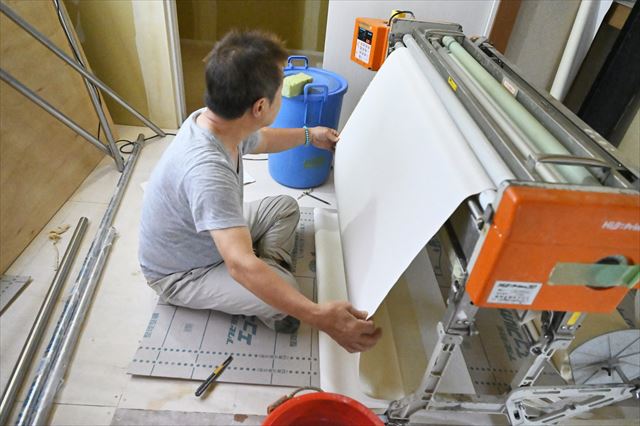
Locate an element on the screen. garbage can is located at coordinates (298, 111).